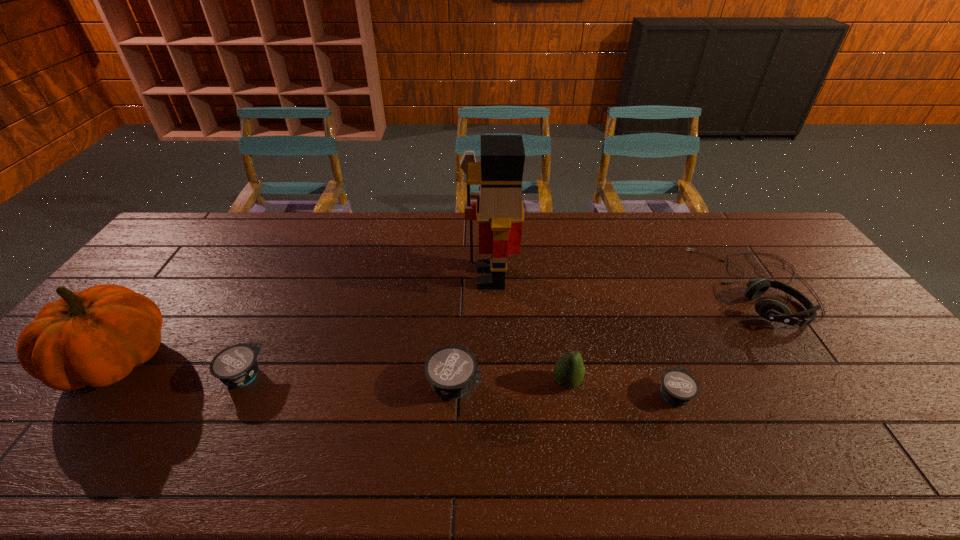
In the image, there is a desktop. At what (x,y) coordinates should I click in order to perform the action: click on free space at the near edge. Please return your answer as a coordinate pair (x, y). The image size is (960, 540). Looking at the image, I should click on (631, 405).

Image resolution: width=960 pixels, height=540 pixels. Find the location of `vacant space at the right edge of the desktop`. vacant space at the right edge of the desktop is located at coordinates (838, 319).

This screenshot has width=960, height=540. Find the location of `vacant space at the far right corner of the desktop`. vacant space at the far right corner of the desktop is located at coordinates click(x=768, y=241).

The height and width of the screenshot is (540, 960). I want to click on free spot between the second yogurt from right to left and the avocado, so pyautogui.click(x=511, y=384).

Locate an element on the screen. Image resolution: width=960 pixels, height=540 pixels. free spot between the fifth tallest object and the headset is located at coordinates (606, 336).

Identify the location of vacant area that lies between the avocado and the fifth tallest object. The height and width of the screenshot is (540, 960). (511, 384).

In order to click on empty location between the nutcracker and the fifth object from left to right in this screenshot , I will do `click(529, 330)`.

Where is `vacant space that's between the third shortest object and the shortest object`? The width and height of the screenshot is (960, 540). vacant space that's between the third shortest object and the shortest object is located at coordinates (564, 390).

Where is `free space between the tallest yogurt and the second tallest yogurt`? free space between the tallest yogurt and the second tallest yogurt is located at coordinates (348, 380).

Find the location of `vacant area between the nutcracker and the sixth object from left to right`. vacant area between the nutcracker and the sixth object from left to right is located at coordinates (582, 336).